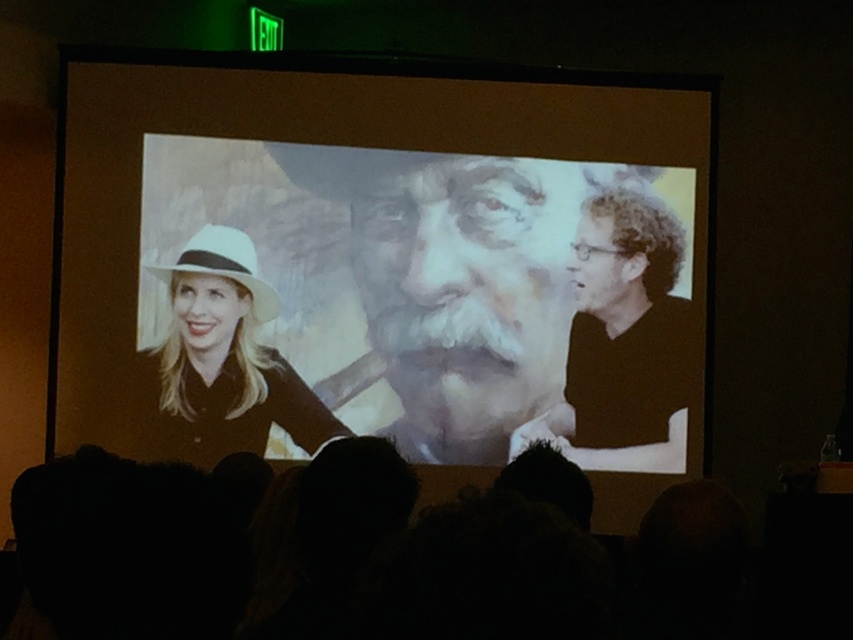
Question: Among these objects, which one is farthest from the camera?

Choices:
 (A) white matte hat at left
 (B) matte black screen at center
 (C) smooth black shirt at center

Answer: (C)

Question: Is matte black screen at center bigger than smooth black shirt at center?

Choices:
 (A) yes
 (B) no

Answer: (A)

Question: Does smooth black shirt at center appear under white matte hat at left?

Choices:
 (A) no
 (B) yes

Answer: (A)

Question: Is matte black screen at center closer to the viewer compared to smooth black shirt at center?

Choices:
 (A) no
 (B) yes

Answer: (B)

Question: Which is farther from the white matte hat at left?

Choices:
 (A) matte black screen at center
 (B) smooth black shirt at center

Answer: (B)

Question: Which point is farther from the camera taking this photo?

Choices:
 (A) (216, 374)
 (B) (556, 310)
 (C) (561, 250)

Answer: (C)